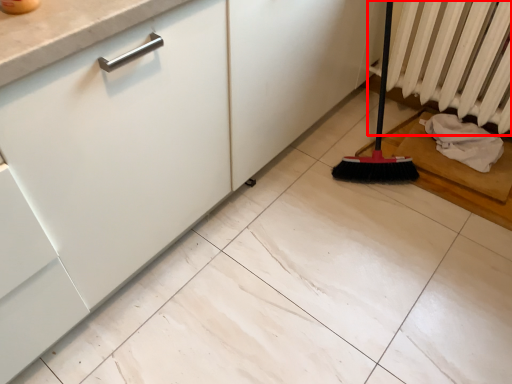
Question: Where is radiator (annotated by the red box) located in relation to material in the image?

Choices:
 (A) left
 (B) right

Answer: (A)